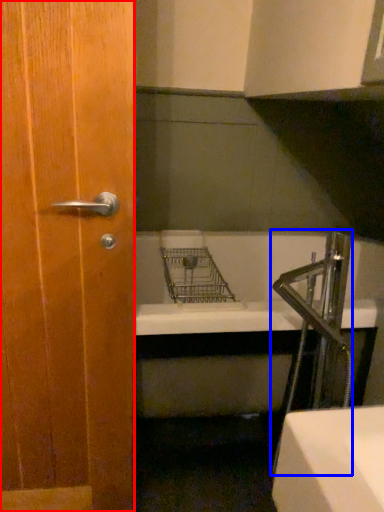
Question: Which object is further to the camera taking this photo, door (highlighted by a red box) or faucet (highlighted by a blue box)?

Choices:
 (A) door
 (B) faucet

Answer: (B)